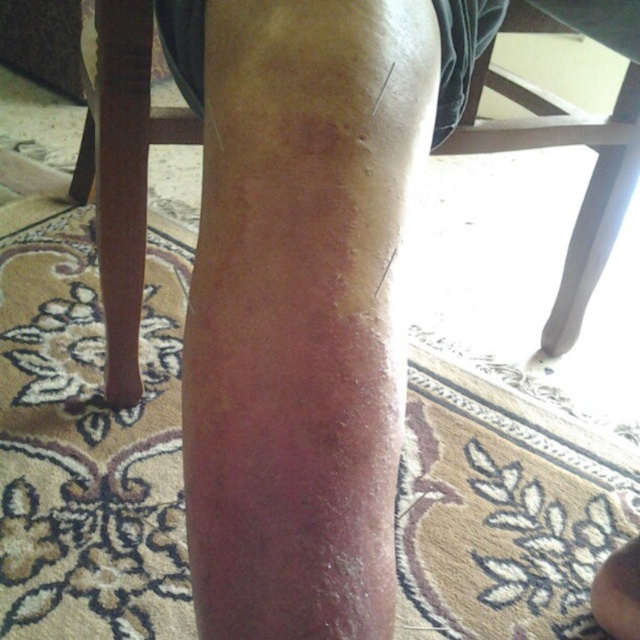
Question: Which point is closer to the camera?

Choices:
 (A) dry skin at center
 (B) brown wood chair at center
 (C) smooth skin at lower right

Answer: (A)

Question: Which object appears closest to the camera in this image?

Choices:
 (A) smooth skin at lower right
 (B) dry skin at center
 (C) brown wood chair at center

Answer: (B)

Question: Is dry skin at center above smooth skin at lower right?

Choices:
 (A) no
 (B) yes

Answer: (B)

Question: Does dry skin at center appear on the right side of smooth skin at lower right?

Choices:
 (A) no
 (B) yes

Answer: (A)

Question: Does dry skin at center have a greater width compared to brown wood chair at center?

Choices:
 (A) no
 (B) yes

Answer: (A)

Question: Which of the following is the closest to the observer?

Choices:
 (A) dry skin at center
 (B) smooth skin at lower right
 (C) brown wood chair at center

Answer: (A)